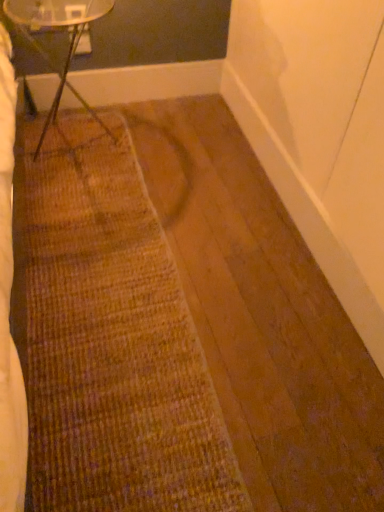
What do you see at coordinates (57, 28) in the screenshot?
I see `clear glass table at upper left` at bounding box center [57, 28].

The height and width of the screenshot is (512, 384). Identify the location of clear glass table at upper left. (57, 28).

In order to click on brown textured mat at center in this screenshot , I will do `click(109, 338)`.

This screenshot has width=384, height=512. What do you see at coordinates (109, 338) in the screenshot?
I see `brown textured mat at center` at bounding box center [109, 338].

The image size is (384, 512). Identify the location of clear glass table at upper left. (57, 28).

Can you confirm if clear glass table at upper left is positioned to the right of brown textured mat at center?

No, clear glass table at upper left is not to the right of brown textured mat at center.

Considering the relative positions of clear glass table at upper left and brown textured mat at center in the image provided, is clear glass table at upper left in front of brown textured mat at center?

No, clear glass table at upper left is behind brown textured mat at center.

Is point (73, 32) positioned behind point (211, 490)?

Yes, point (73, 32) is behind point (211, 490).

From the image's perspective, which object appears higher, clear glass table at upper left or brown textured mat at center?

From the image's view, clear glass table at upper left is above.

From a real-world perspective, is clear glass table at upper left below brown textured mat at center?

No, from a real-world perspective, clear glass table at upper left is not below brown textured mat at center.

Is clear glass table at upper left thinner than brown textured mat at center?

Correct, the width of clear glass table at upper left is less than that of brown textured mat at center.

Can you confirm if clear glass table at upper left is shorter than brown textured mat at center?

Incorrect, the height of clear glass table at upper left does not fall short of that of brown textured mat at center.

Considering the sizes of clear glass table at upper left and brown textured mat at center in the image, is clear glass table at upper left bigger or smaller than brown textured mat at center?

Clearly, clear glass table at upper left is larger in size than brown textured mat at center.

Is clear glass table at upper left not inside brown textured mat at center?

clear glass table at upper left lies outside brown textured mat at center's area.

Is clear glass table at upper left next to brown textured mat at center?

clear glass table at upper left and brown textured mat at center are clearly separated.

Is clear glass table at upper left oriented towards brown textured mat at center?

Yes, clear glass table at upper left is facing brown textured mat at center.

The height and width of the screenshot is (512, 384). I want to click on doormat on the right of clear glass table at upper left, so click(109, 338).

Between brown textured mat at center and clear glass table at upper left, which one appears on the left side from the viewer's perspective?

From the viewer's perspective, clear glass table at upper left appears more on the left side.

Considering the positions of objects brown textured mat at center and clear glass table at upper left in the image provided, who is behind, brown textured mat at center or clear glass table at upper left?

clear glass table at upper left is more distant.

Is point (114, 290) behind point (45, 3)?

No, it is not.

From the image's perspective, is brown textured mat at center beneath clear glass table at upper left?

Yes, from the image's perspective, brown textured mat at center is below clear glass table at upper left.

From a real-world perspective, relative to clear glass table at upper left, is brown textured mat at center vertically above or below?

In terms of real-world spatial position, brown textured mat at center is below clear glass table at upper left.

Which object is wider, brown textured mat at center or clear glass table at upper left?

Wider between the two is brown textured mat at center.

Is brown textured mat at center taller or shorter than clear glass table at upper left?

Considering their sizes, brown textured mat at center has less height than clear glass table at upper left.

Who is bigger, brown textured mat at center or clear glass table at upper left?

With larger size is clear glass table at upper left.

Is brown textured mat at center spatially inside clear glass table at upper left, or outside of it?

brown textured mat at center is located beyond the bounds of clear glass table at upper left.

Is brown textured mat at center directly adjacent to clear glass table at upper left?

No, brown textured mat at center is not beside clear glass table at upper left.

Is brown textured mat at center oriented away from clear glass table at upper left?

No, brown textured mat at center is not facing the opposite direction of clear glass table at upper left.

From the picture: Measure the distance from brown textured mat at center to clear glass table at upper left.

A distance of 25.90 inches exists between brown textured mat at center and clear glass table at upper left.

I want to click on doormat below the clear glass table at upper left (from a real-world perspective), so click(x=109, y=338).

Find the location of a particular element. table that appears behind the brown textured mat at center is located at coordinates (57, 28).

Find the location of a particular element. The height and width of the screenshot is (512, 384). table located on the left of brown textured mat at center is located at coordinates (57, 28).